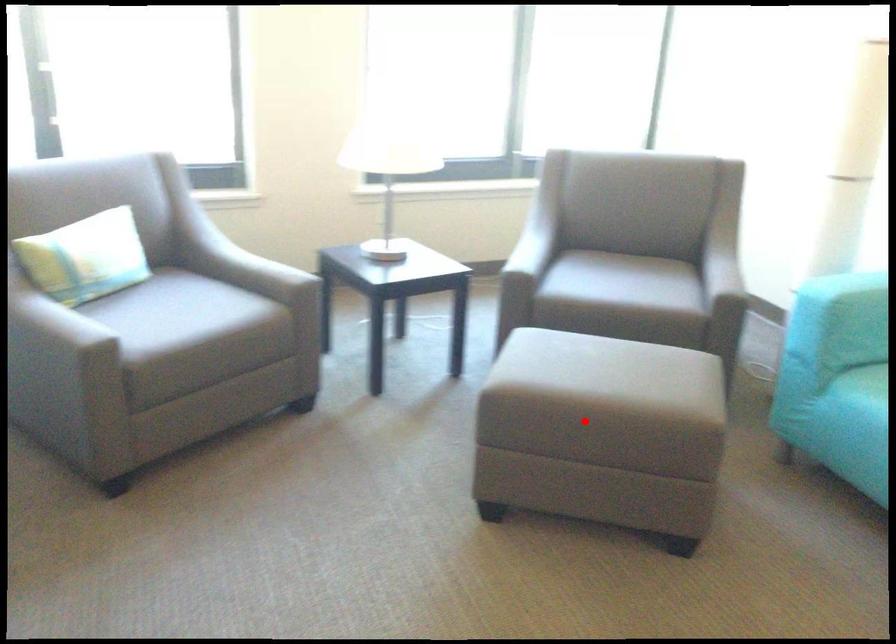
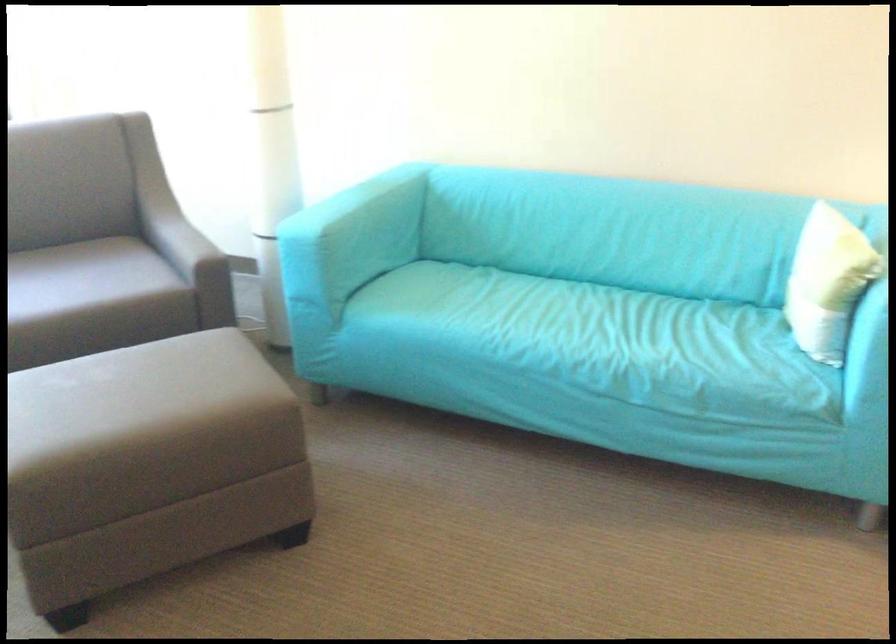
Locate, in the second image, the point that corresponds to the highlighted location in the first image.

(149, 464)